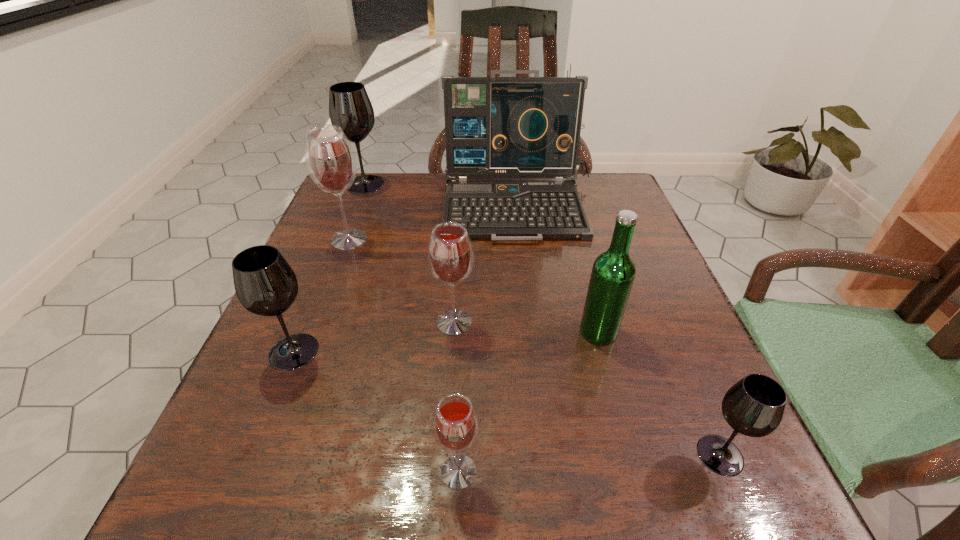
The height and width of the screenshot is (540, 960). What are the coordinates of `the closest red wineglass to the green beer bottle` in the screenshot? It's located at (450, 253).

The width and height of the screenshot is (960, 540). Find the location of `free point that satisfies the following two spatial constraints: 1. on the back side of the second nearest gray wineglass; 2. on the right side of the second smallest red wineglass`. free point that satisfies the following two spatial constraints: 1. on the back side of the second nearest gray wineglass; 2. on the right side of the second smallest red wineglass is located at coordinates (305, 322).